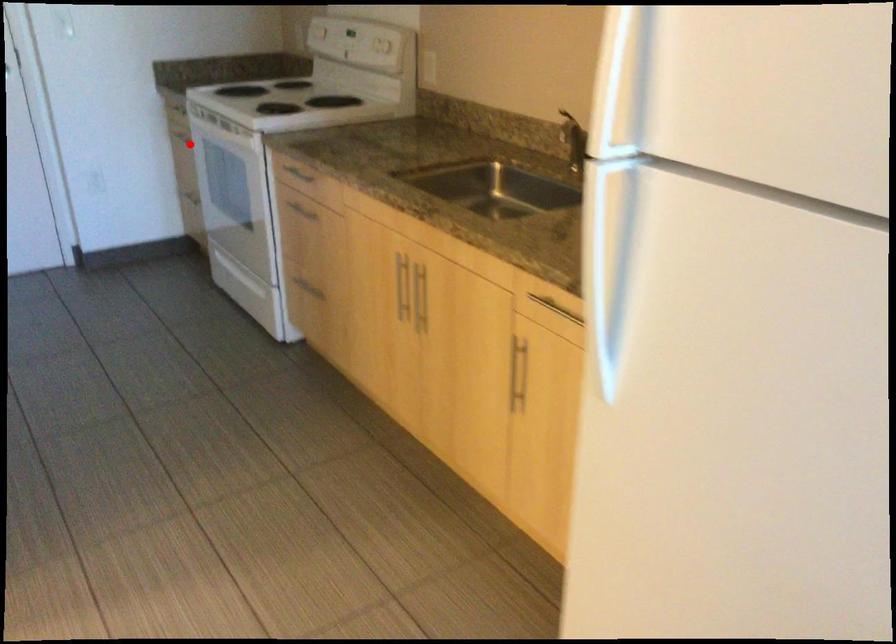
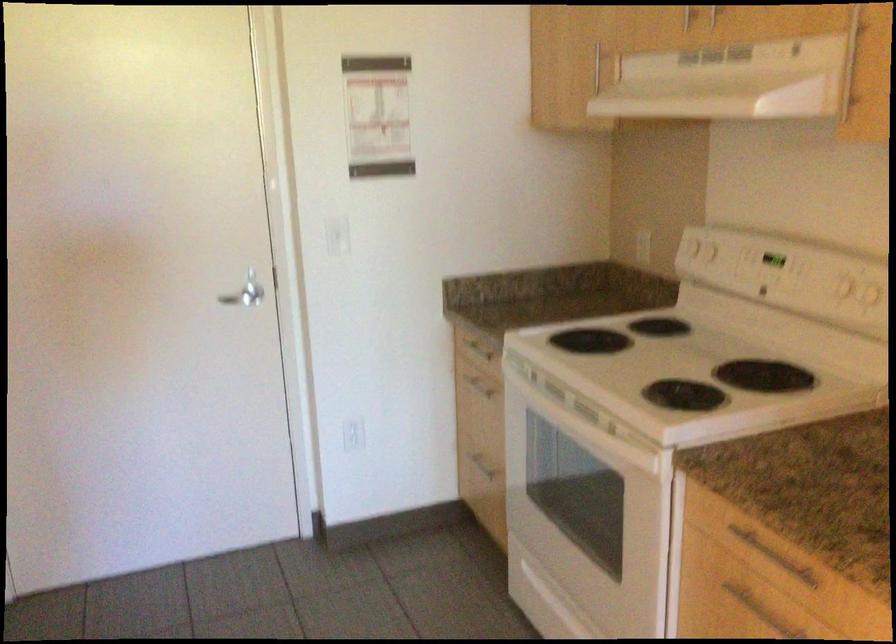
Where in the second image is the point corresponding to the highlighted location from the first image?

(479, 384)